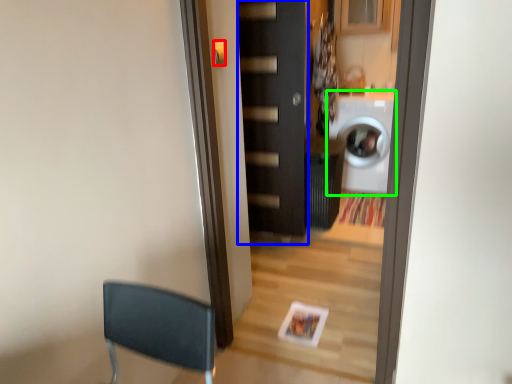
Question: Considering the real-world distances, which object is closest to door handle (highlighted by a red box)? door (highlighted by a blue box) or washing machine (highlighted by a green box).

Choices:
 (A) door
 (B) washing machine

Answer: (A)